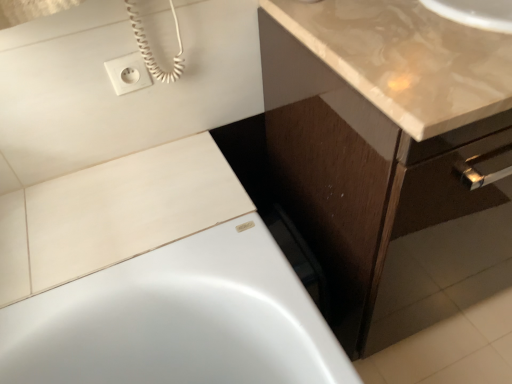
Question: Is white plastic outlet at upper left at the back of white matte tile at upper left?

Choices:
 (A) no
 (B) yes

Answer: (A)

Question: Considering the relative sizes of white matte tile at upper left and white plastic outlet at upper left in the image provided, is white matte tile at upper left taller than white plastic outlet at upper left?

Choices:
 (A) yes
 (B) no

Answer: (B)

Question: From the image's perspective, is white matte tile at upper left over white plastic outlet at upper left?

Choices:
 (A) no
 (B) yes

Answer: (A)

Question: Is white matte tile at upper left oriented towards white plastic outlet at upper left?

Choices:
 (A) yes
 (B) no

Answer: (B)

Question: Can you confirm if white matte tile at upper left is wider than white plastic outlet at upper left?

Choices:
 (A) no
 (B) yes

Answer: (B)

Question: From a real-world perspective, is white matte tile at upper left beneath white plastic outlet at upper left?

Choices:
 (A) yes
 (B) no

Answer: (A)

Question: From the image's perspective, would you say white plastic outlet at upper left is positioned over white matte tile at upper left?

Choices:
 (A) yes
 (B) no

Answer: (A)

Question: Is white plastic outlet at upper left taller than white matte tile at upper left?

Choices:
 (A) no
 (B) yes

Answer: (B)

Question: From the image's perspective, is white plastic outlet at upper left below white matte tile at upper left?

Choices:
 (A) no
 (B) yes

Answer: (A)

Question: Is white plastic outlet at upper left to the left of white matte tile at upper left from the viewer's perspective?

Choices:
 (A) no
 (B) yes

Answer: (A)

Question: Is white plastic outlet at upper left to the right of white matte tile at upper left from the viewer's perspective?

Choices:
 (A) no
 (B) yes

Answer: (B)

Question: Is white plastic outlet at upper left not close to white matte tile at upper left?

Choices:
 (A) no
 (B) yes

Answer: (A)

Question: Is white matte tile at upper left taller than brown wood cabinet at lower right?

Choices:
 (A) no
 (B) yes

Answer: (A)